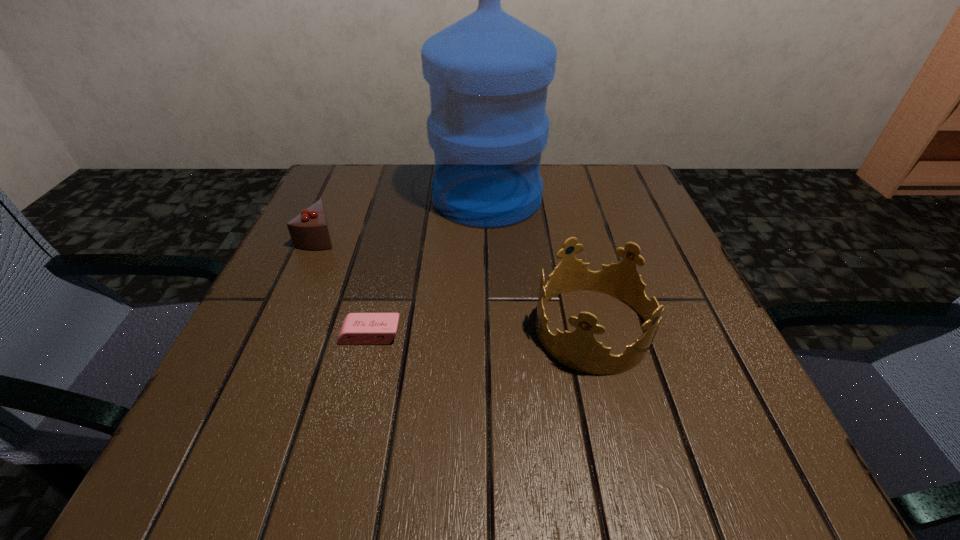
Where is `water jug`? water jug is located at coordinates (488, 73).

Where is `tiara`? tiara is located at coordinates (579, 350).

Identify the location of the second shortest object. Image resolution: width=960 pixels, height=540 pixels. (309, 230).

The height and width of the screenshot is (540, 960). I want to click on the leftmost object, so click(x=309, y=230).

Find the location of `the shortest object`. the shortest object is located at coordinates (357, 328).

This screenshot has height=540, width=960. Find the location of `eraser`. eraser is located at coordinates (357, 328).

Locate an element on the screen. The width and height of the screenshot is (960, 540). vacant space located on the front of the water jug is located at coordinates (492, 394).

The image size is (960, 540). I want to click on free location located on the front-facing side of the third shortest object, so click(x=304, y=328).

Locate an element on the screen. Image resolution: width=960 pixels, height=540 pixels. vacant space located on the front-facing side of the third shortest object is located at coordinates (487, 328).

This screenshot has width=960, height=540. In order to click on vacant point located on the front-facing side of the third shortest object in this screenshot , I will do `click(310, 328)`.